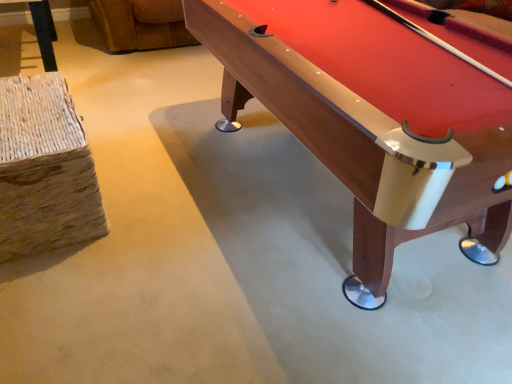
What is the approximate width of woven straw stool at left?

17.66 inches.

The height and width of the screenshot is (384, 512). What do you see at coordinates (44, 169) in the screenshot?
I see `woven straw stool at left` at bounding box center [44, 169].

Measure the distance between point (44,98) and camera.

The distance of point (44,98) from camera is 1.86 meters.

The width and height of the screenshot is (512, 384). What are the coordinates of `woven straw stool at left` in the screenshot? It's located at (44, 169).

Where is `wooden pool table at right`? The height and width of the screenshot is (384, 512). wooden pool table at right is located at coordinates (376, 118).

Measure the distance between wooden pool table at right and camera.

wooden pool table at right and camera are 95.79 centimeters apart from each other.

What do you see at coordinates (376, 118) in the screenshot? Image resolution: width=512 pixels, height=384 pixels. I see `wooden pool table at right` at bounding box center [376, 118].

This screenshot has width=512, height=384. In order to click on woven straw stool at left in this screenshot , I will do `click(44, 169)`.

Considering the positions of objects woven straw stool at left and wooden pool table at right in the image provided, who is more to the left, woven straw stool at left or wooden pool table at right?

From the viewer's perspective, woven straw stool at left appears more on the left side.

Is the depth of woven straw stool at left less than that of wooden pool table at right?

No, woven straw stool at left is further to the viewer.

Which is nearer, (37,212) or (352,289)?

Point (37,212) is farther from the camera than point (352,289).

From the image's perspective, which object appears higher, woven straw stool at left or wooden pool table at right?

wooden pool table at right appears higher in the image.

From a real-world perspective, is woven straw stool at left on top of wooden pool table at right?

No.

Does woven straw stool at left have a lesser width compared to wooden pool table at right?

Yes.

Who is taller, woven straw stool at left or wooden pool table at right?

Standing taller between the two is wooden pool table at right.

Considering the sizes of objects woven straw stool at left and wooden pool table at right in the image provided, who is smaller, woven straw stool at left or wooden pool table at right?

Smaller between the two is woven straw stool at left.

Is wooden pool table at right completely or partially inside woven straw stool at left?

Definitely not — wooden pool table at right is not inside woven straw stool at left.

Is there a large distance between woven straw stool at left and wooden pool table at right?

No, there isn't a large distance between woven straw stool at left and wooden pool table at right.

Is wooden pool table at right at the back of woven straw stool at left?

woven straw stool at left does not have its back to wooden pool table at right.

How different are the orientations of woven straw stool at left and wooden pool table at right in degrees?

The angular difference between woven straw stool at left and wooden pool table at right is 1.46 degrees.

How far apart are woven straw stool at left and wooden pool table at right?

99.35 centimeters.

Identify the location of billiard table that is above the woven straw stool at left (from the image's perspective). (376, 118).

Considering the relative positions of wooden pool table at right and woven straw stool at left in the image provided, is wooden pool table at right to the right of woven straw stool at left from the viewer's perspective?

Indeed, wooden pool table at right is positioned on the right side of woven straw stool at left.

Considering the relative positions of wooden pool table at right and woven straw stool at left in the image provided, is wooden pool table at right behind woven straw stool at left?

No, wooden pool table at right is in front of woven straw stool at left.

Which is closer, (360,82) or (31,117)?

The point (360,82) is closer to the camera.

From the image's perspective, is wooden pool table at right below woven straw stool at left?

No, from the image's perspective, wooden pool table at right is not below woven straw stool at left.

From a real-world perspective, between wooden pool table at right and woven straw stool at left, who is vertically higher?

wooden pool table at right, from a real-world perspective.

Which of these two, wooden pool table at right or woven straw stool at left, is wider?

Wider between the two is wooden pool table at right.

From their relative heights in the image, would you say wooden pool table at right is taller or shorter than woven straw stool at left?

In the image, wooden pool table at right appears to be taller than woven straw stool at left.

Considering the relative sizes of wooden pool table at right and woven straw stool at left in the image provided, is wooden pool table at right smaller than woven straw stool at left?

No.

Is wooden pool table at right outside of woven straw stool at left?

That's correct, wooden pool table at right is outside of woven straw stool at left.

Are wooden pool table at right and woven straw stool at left located far from each other?

That's not correct — wooden pool table at right is a little close to woven straw stool at left.

Is wooden pool table at right aimed at woven straw stool at left?

No, wooden pool table at right is not turned towards woven straw stool at left.

How different are the orientations of wooden pool table at right and woven straw stool at left in degrees?

They differ by 1.46 degrees in their facing directions.

Locate an element on the screen. bar stool beneath the wooden pool table at right (from a real-world perspective) is located at coordinates pyautogui.click(x=44, y=169).

Where is `billiard table on the right of woven straw stool at left`? Image resolution: width=512 pixels, height=384 pixels. billiard table on the right of woven straw stool at left is located at coordinates (376, 118).

The height and width of the screenshot is (384, 512). Find the location of `bar stool that appears below the wooden pool table at right (from a real-world perspective)`. bar stool that appears below the wooden pool table at right (from a real-world perspective) is located at coordinates (44, 169).